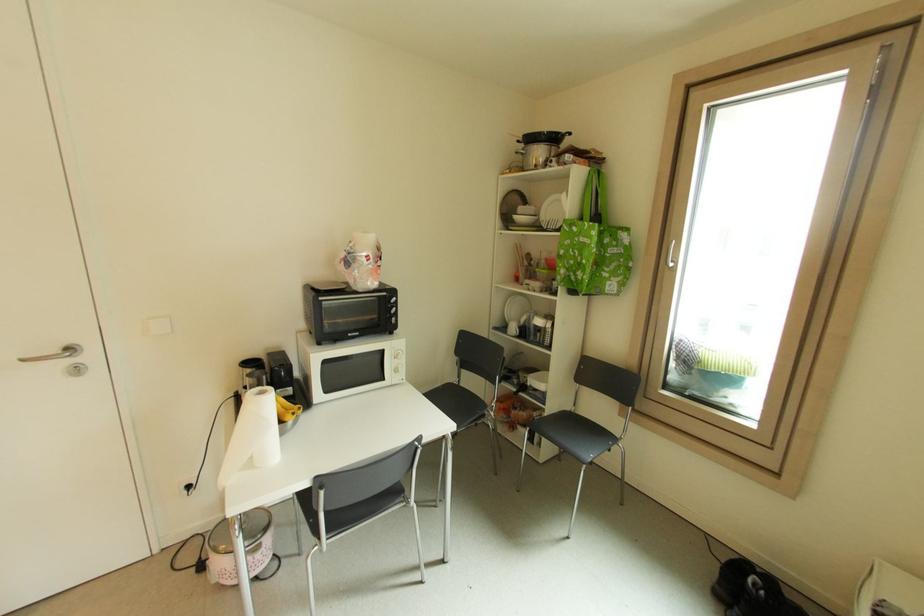
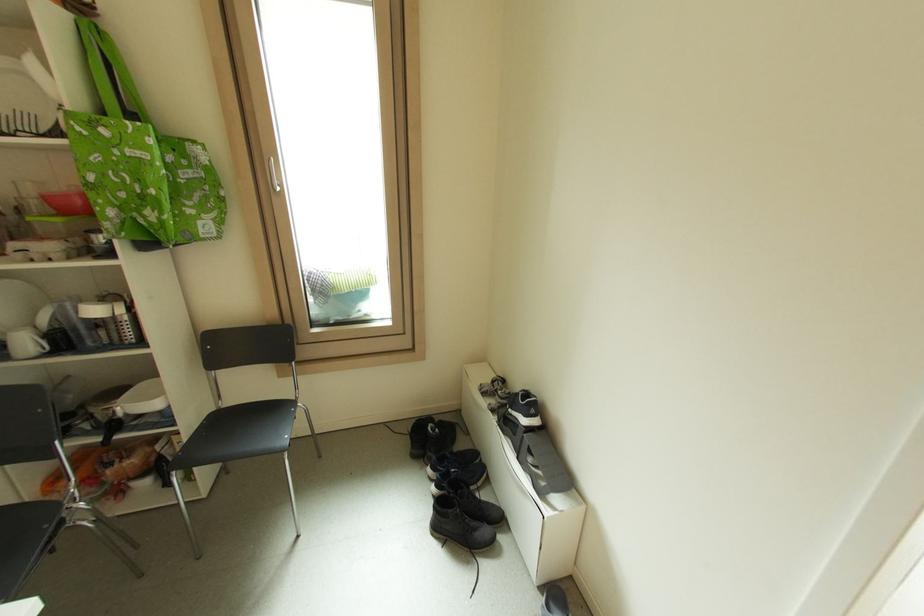
The point at (x=506, y=458) is marked in the first image. Where is the corresponding point in the second image?

(141, 546)